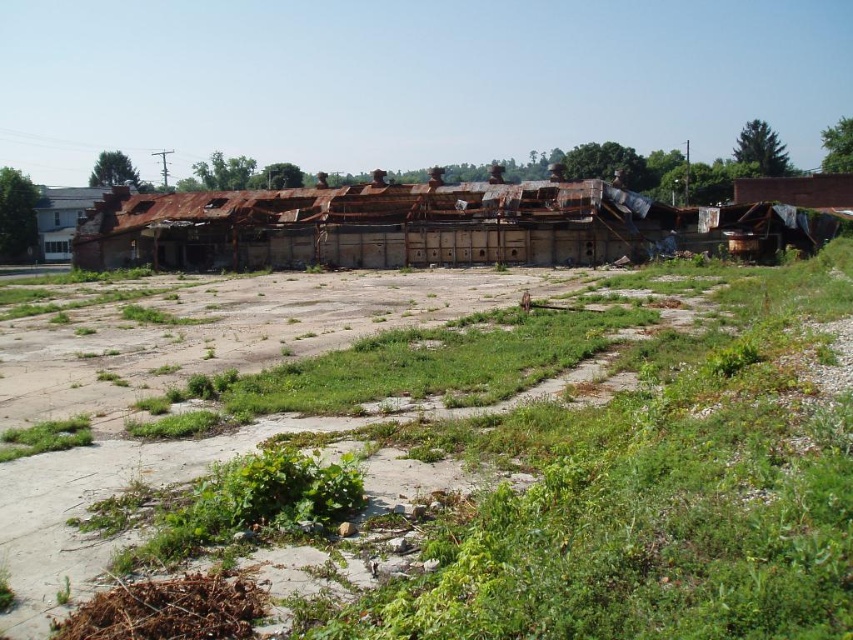
Based on the photo, you are a drone operator tasked with capturing aerial footage of the abandoned industrial site. Your drone has a maximum flight distance of 40 meters before needing to return. If you take off from your current position and fly directly towards the rusty metal building at center, will your drone be able to reach it and return safely without exceeding its range?

The rusty metal building at center is 38.50 meters away from camera. Since the drone can fly up to 40 meters, it can safely reach the building and return within the 40 meter limit because 38.50 meters is less than half of 40 meters. Wait, actually, the round trip distance would be double the one way distance. Let me recalculate. 38.50 meters one way means the round trip is 77 meters, which exceeds the 40 meter limit. Therefore, the drone cannot safely return without exceeding its range.